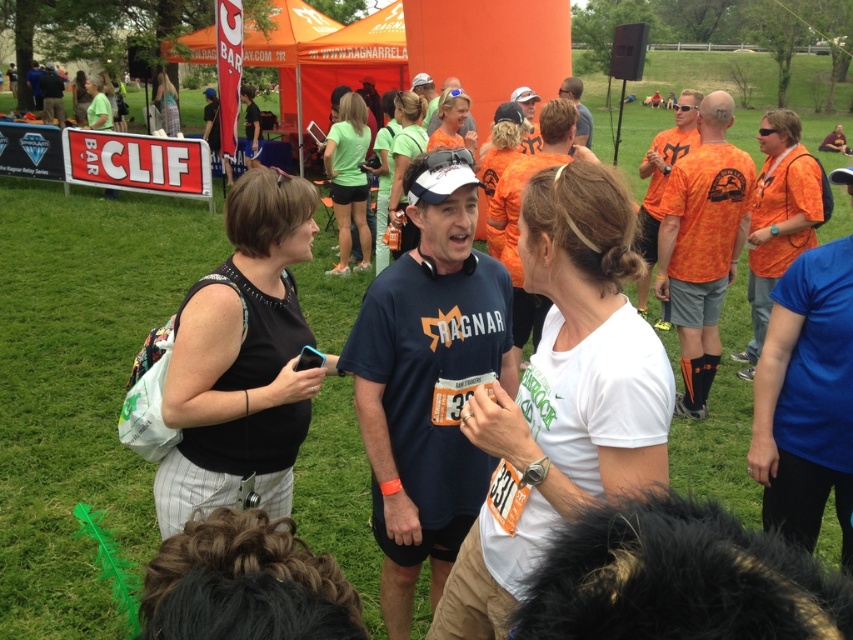
Question: Can you confirm if white matte t-shirt at center is positioned to the right of black fabric bag at left?

Choices:
 (A) no
 (B) yes

Answer: (B)

Question: Among these objects, which one is nearest to the camera?

Choices:
 (A) green fabric shirt at center
 (B) matte orange shirt at center
 (C) white matte t-shirt at center
 (D) green fabric shorts at center

Answer: (C)

Question: In this image, where is white matte t-shirt at center located relative to matte orange shirt at center?

Choices:
 (A) right
 (B) left

Answer: (A)

Question: Which of the following is the farthest from the observer?

Choices:
 (A) (479, 580)
 (B) (260, 422)
 (C) (451, 118)

Answer: (C)

Question: Which point is farther to the camera?

Choices:
 (A) green fabric shirt at center
 (B) green fabric shorts at center
 (C) matte orange shirt at center

Answer: (B)

Question: Considering the relative positions of white matte t-shirt at center and matte orange shirt at center in the image provided, where is white matte t-shirt at center located with respect to matte orange shirt at center?

Choices:
 (A) left
 (B) right

Answer: (B)